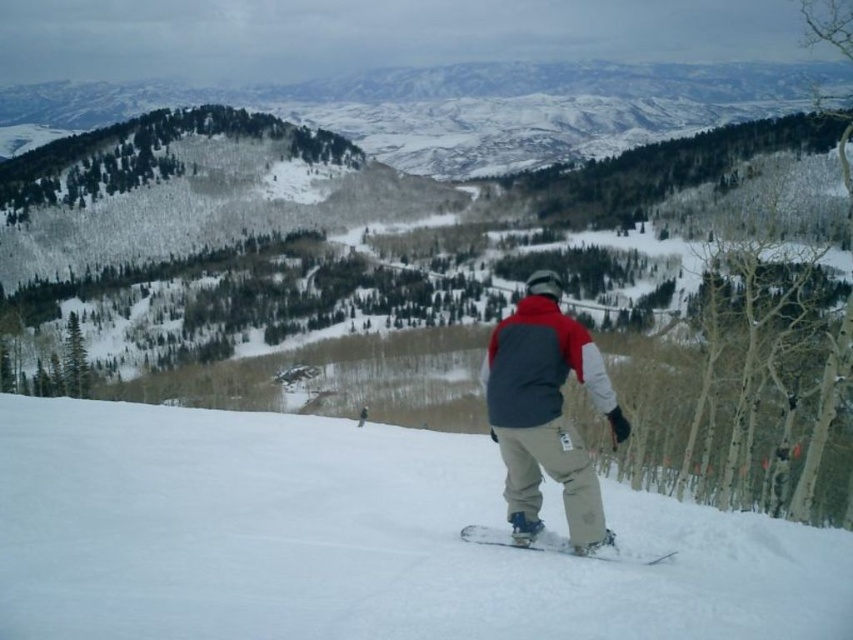
Question: Which object is the closest to the white matte snowboard at center?

Choices:
 (A) white snowboard at center
 (B) gray fleece jacket at center

Answer: (B)

Question: Where is white snowboard at center located in relation to gray fleece jacket at center in the image?

Choices:
 (A) below
 (B) above

Answer: (A)

Question: Is white snowboard at center to the right of white matte snowboard at center from the viewer's perspective?

Choices:
 (A) no
 (B) yes

Answer: (A)

Question: Which object is positioned farthest from the white matte snowboard at center?

Choices:
 (A) white snowboard at center
 (B) gray fleece jacket at center

Answer: (A)

Question: Does white snowboard at center appear on the right side of gray fleece jacket at center?

Choices:
 (A) no
 (B) yes

Answer: (A)

Question: Which point is farther to the camera?

Choices:
 (A) gray fleece jacket at center
 (B) white matte snowboard at center
 (C) white snowboard at center

Answer: (A)